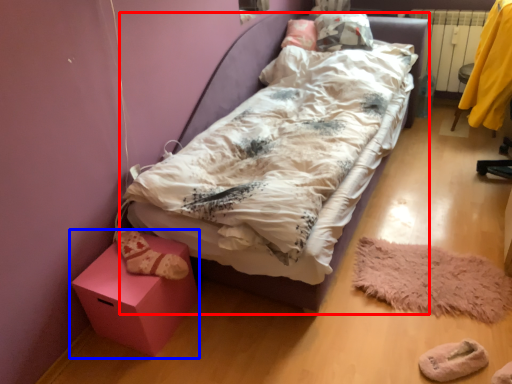
Question: Which point is closer to the camera, bed (highlighted by a red box) or furniture (highlighted by a blue box)?

Choices:
 (A) bed
 (B) furniture

Answer: (A)